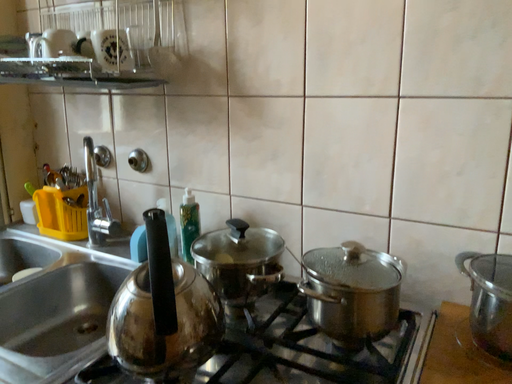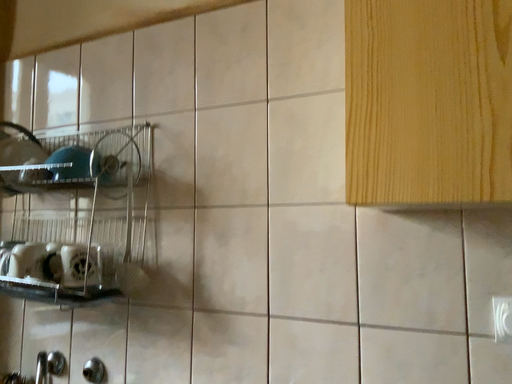
Question: Which way did the camera rotate in the video?

Choices:
 (A) rotated upward
 (B) rotated downward

Answer: (A)